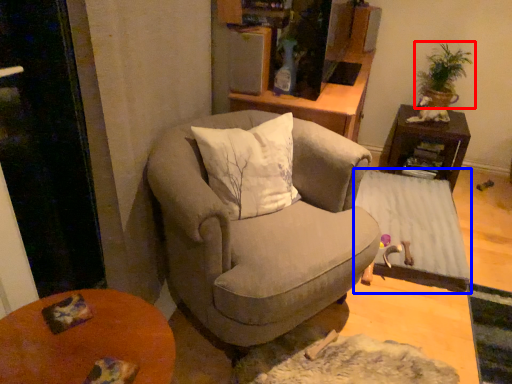
Question: Among these objects, which one is nearest to the camera, houseplant (highlighted by a red box) or table (highlighted by a blue box)?

Choices:
 (A) houseplant
 (B) table

Answer: (B)